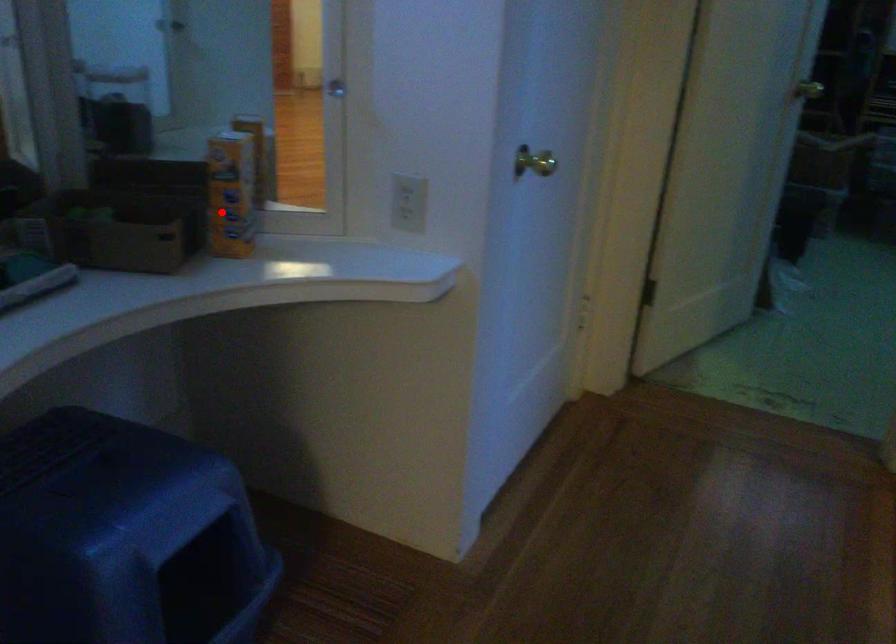
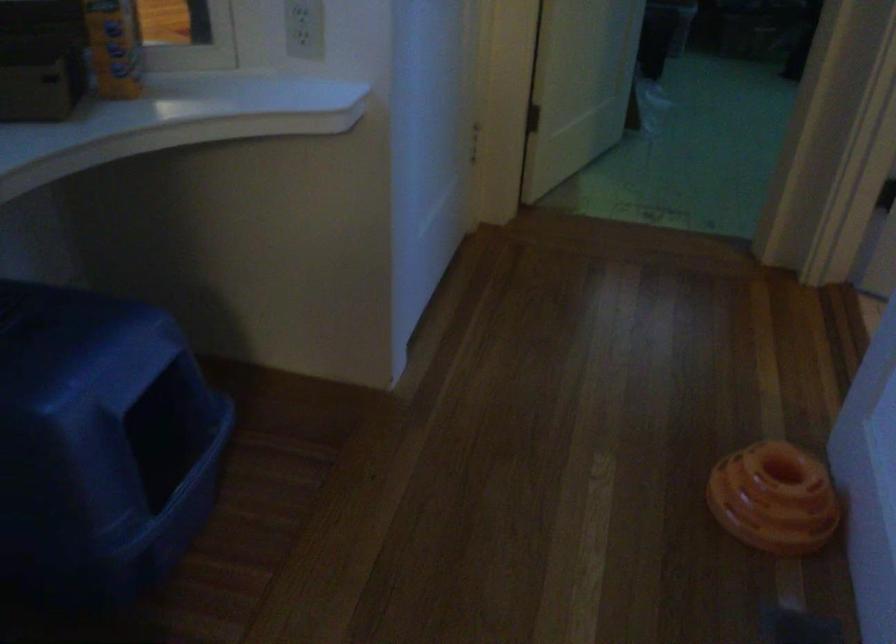
The point at the highlighted location is marked in the first image. Where is the corresponding point in the second image?

(114, 46)